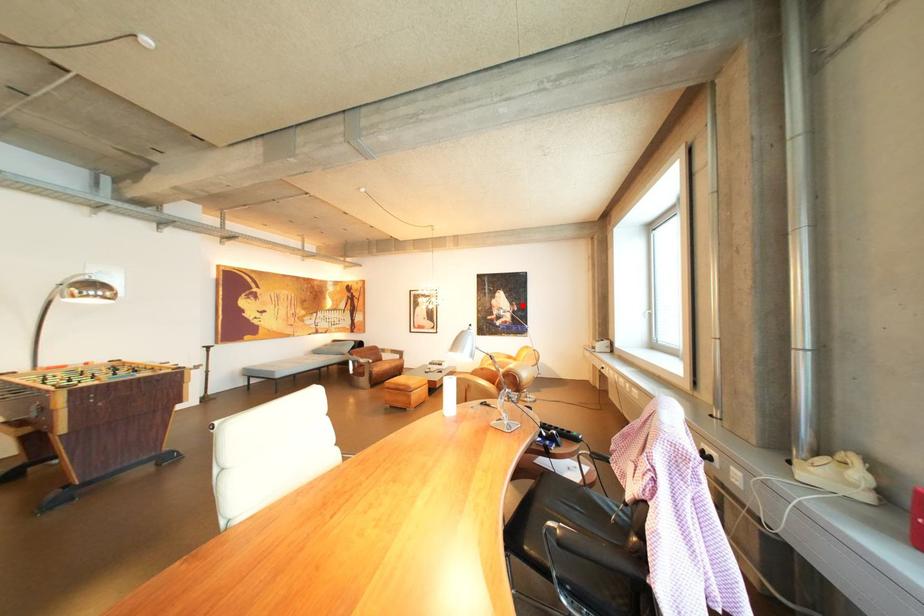
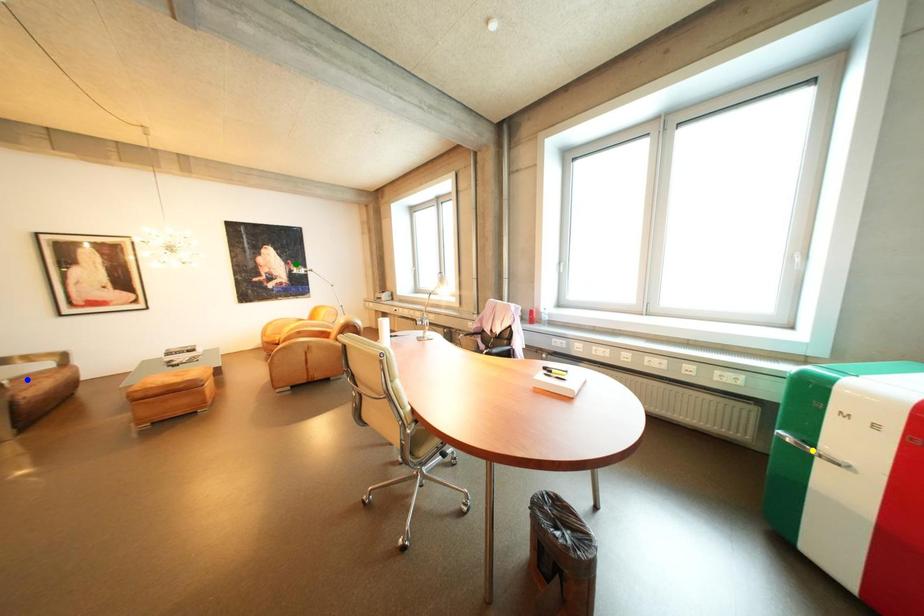
Question: I am providing you with two images of the same scene from different viewpoints. A red point is marked on the first image. You are given multiple points on the second image. Can you choose the point in image 2 that corresponds to the point in image 1?

Choices:
 (A) yellow point
 (B) green point
 (C) blue point

Answer: (B)